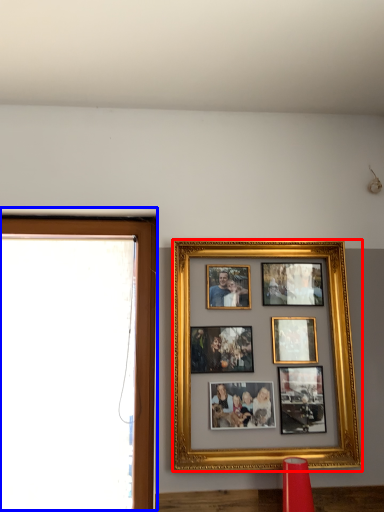
Question: Which point is closer to the camera, picture frame (highlighted by a red box) or window frame (highlighted by a blue box)?

Choices:
 (A) picture frame
 (B) window frame

Answer: (A)